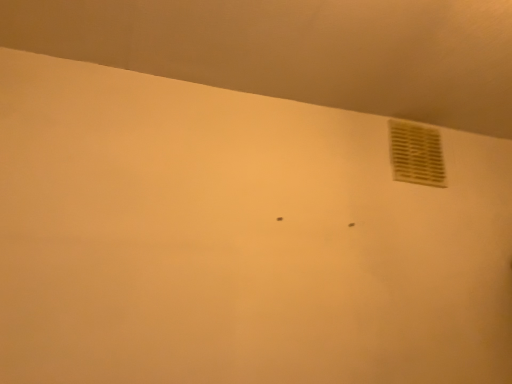
The width and height of the screenshot is (512, 384). What do you see at coordinates (416, 154) in the screenshot? I see `white plastic vent at upper right` at bounding box center [416, 154].

Locate an element on the screen. Image resolution: width=512 pixels, height=384 pixels. white plastic vent at upper right is located at coordinates [416, 154].

In order to face white plastic vent at upper right, should I rotate leftwards or rightwards?

It's best to rotate right around 20.881 degrees.

In order to click on white plastic vent at upper right in this screenshot , I will do `click(416, 154)`.